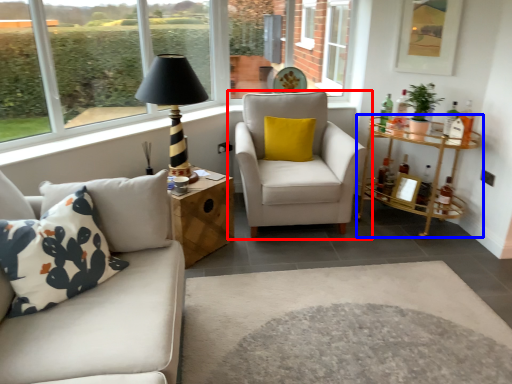
Question: Among these objects, which one is nearest to the camera, chair (highlighted by a red box) or table (highlighted by a blue box)?

Choices:
 (A) chair
 (B) table

Answer: (A)